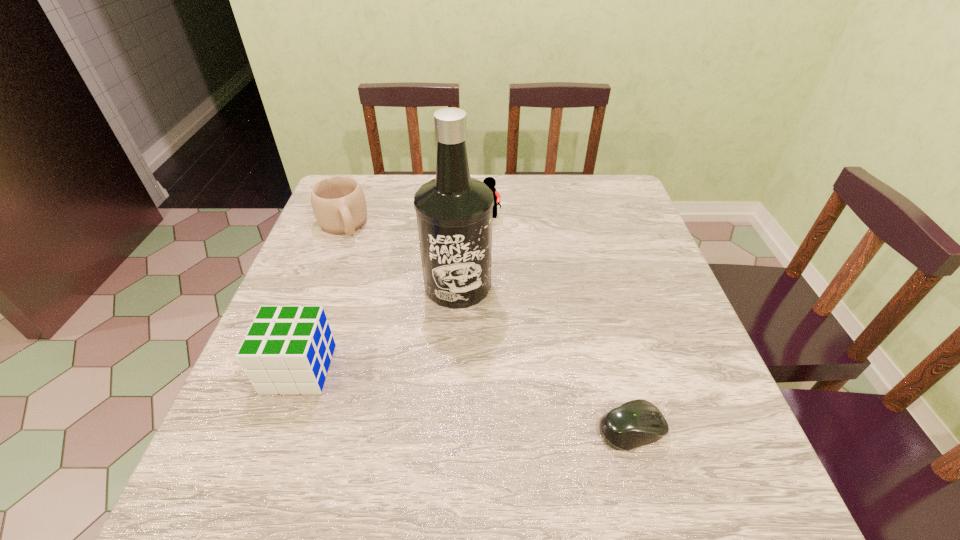
In the image, there is a desktop. Where is `vacant area at the near right corner`? The width and height of the screenshot is (960, 540). vacant area at the near right corner is located at coordinates coord(701,413).

The image size is (960, 540). What are the coordinates of `vacant space that is in between the cube and the rightmost object` in the screenshot? It's located at (466, 399).

Find the location of `unoccupied position between the mug and the liquor`. unoccupied position between the mug and the liquor is located at coordinates (400, 254).

The width and height of the screenshot is (960, 540). In order to click on unoccupied area between the Lego and the second nearest object in this screenshot , I will do `click(394, 293)`.

Find the location of a particular element. The width and height of the screenshot is (960, 540). free space between the nearest object and the fourth farthest object is located at coordinates (466, 399).

Find the location of `blank region between the mug and the nearest object`. blank region between the mug and the nearest object is located at coordinates (487, 327).

Locate an element on the screen. free point between the fourth farthest object and the Lego is located at coordinates (394, 293).

Locate an element on the screen. This screenshot has height=540, width=960. empty space that is in between the liquor and the mouse is located at coordinates (544, 357).

Where is `vacant space that is in between the Lego and the mug`? vacant space that is in between the Lego and the mug is located at coordinates (415, 220).

Image resolution: width=960 pixels, height=540 pixels. Identify the location of free space between the Lego and the mug. (415, 220).